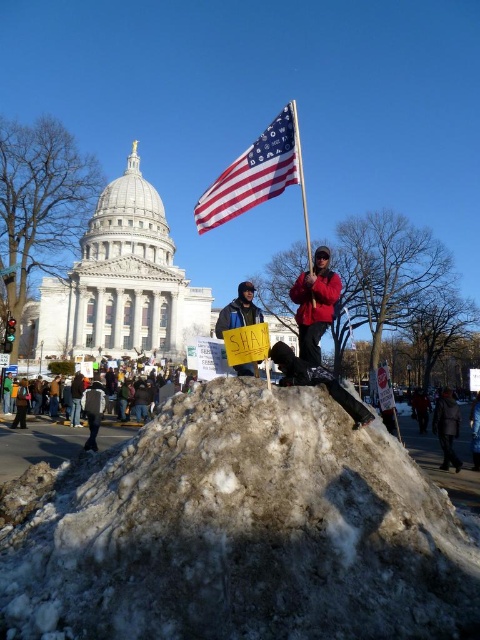
Question: Which object is the closest to the white frosty mound at center?

Choices:
 (A) dark blue jacket at center
 (B) american flag at center
 (C) red matte jacket at center
 (D) dark gray coat at lower right

Answer: (A)

Question: Which point is closer to the camera?

Choices:
 (A) (444, 392)
 (B) (319, 289)
 (C) (146, 396)

Answer: (B)

Question: Is american flag at center closer to the viewer compared to dark gray coat at lower right?

Choices:
 (A) no
 (B) yes

Answer: (A)

Question: Observing the image, what is the correct spatial positioning of white frosty mound at center in reference to american flag at center?

Choices:
 (A) above
 (B) below

Answer: (B)

Question: Which is farther from the white frosty mound at center?

Choices:
 (A) dark gray coat at lower right
 (B) american flag at center

Answer: (B)

Question: Can you confirm if american flag at center is positioned to the left of dark gray coat at lower right?

Choices:
 (A) yes
 (B) no

Answer: (A)